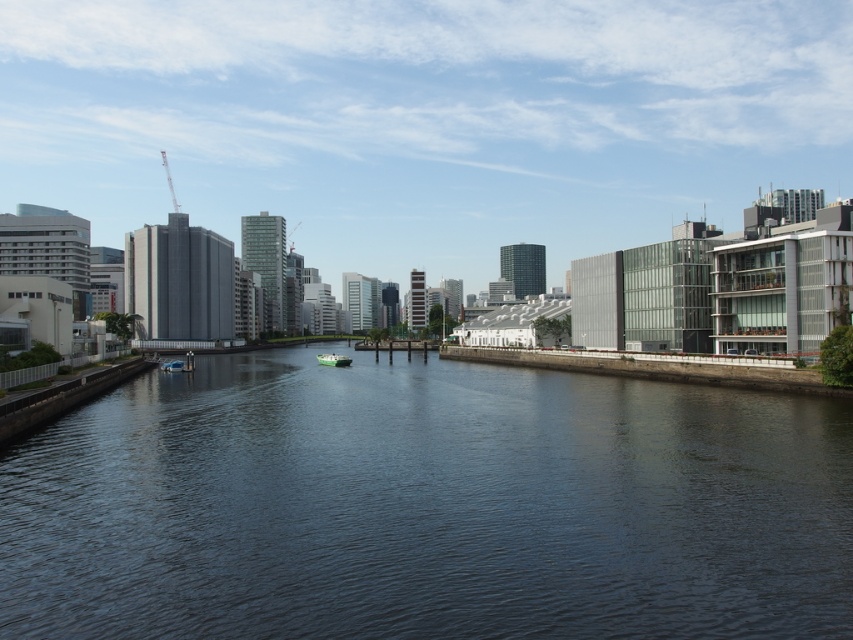
Question: Which object appears farthest from the camera in this image?

Choices:
 (A) dark blue water at center
 (B) green matte boat at center
 (C) blue glossy boat at center

Answer: (B)

Question: Does green matte boat at center appear on the left side of blue glossy boat at center?

Choices:
 (A) no
 (B) yes

Answer: (A)

Question: Among these objects, which one is farthest from the camera?

Choices:
 (A) dark blue water at center
 (B) blue glossy boat at center

Answer: (B)

Question: Does dark blue water at center have a smaller size compared to blue glossy boat at center?

Choices:
 (A) yes
 (B) no

Answer: (B)

Question: Which object is the farthest from the blue glossy boat at center?

Choices:
 (A) green matte boat at center
 (B) dark blue water at center

Answer: (B)

Question: Considering the relative positions of green matte boat at center and blue glossy boat at center in the image provided, where is green matte boat at center located with respect to blue glossy boat at center?

Choices:
 (A) below
 (B) above

Answer: (A)